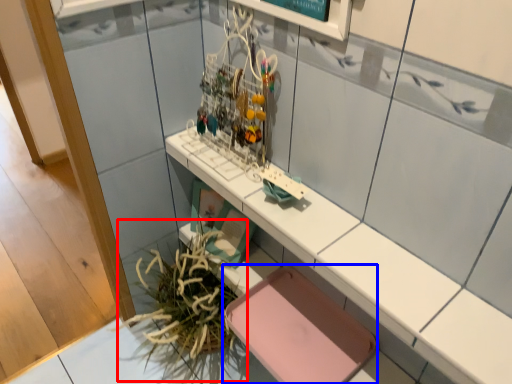
Question: Which of the following is the farthest to the observer, plant (highlighted by a red box) or chair (highlighted by a blue box)?

Choices:
 (A) plant
 (B) chair

Answer: (A)